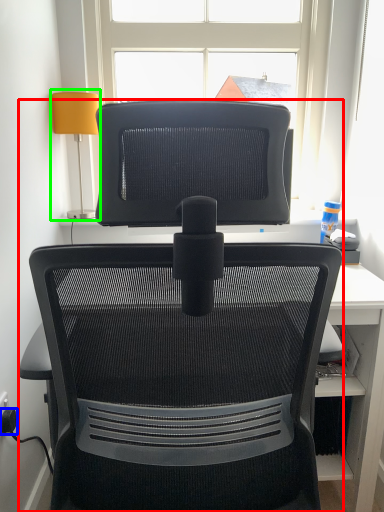
Question: Which object is positioned farthest from chair (highlighted by a red box)? Select from plug (highlighted by a blue box) and table lamp (highlighted by a green box).

Choices:
 (A) plug
 (B) table lamp

Answer: (B)